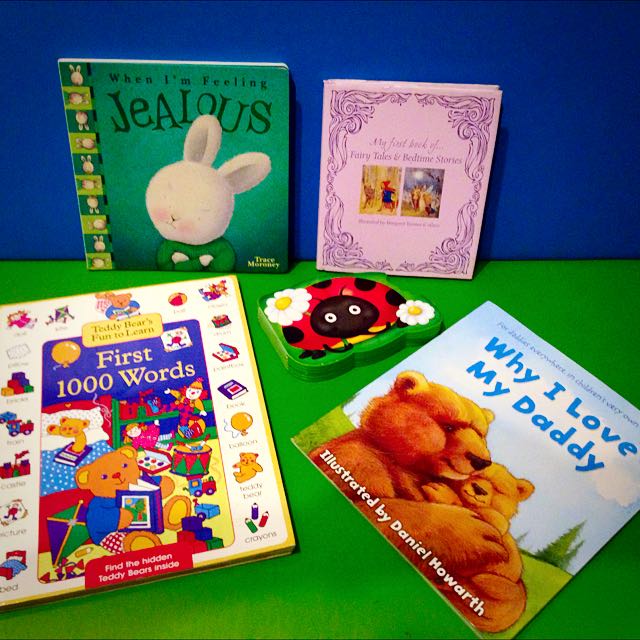
Where is `book, why i love my daddy`? The width and height of the screenshot is (640, 640). book, why i love my daddy is located at coordinates (540, 457).